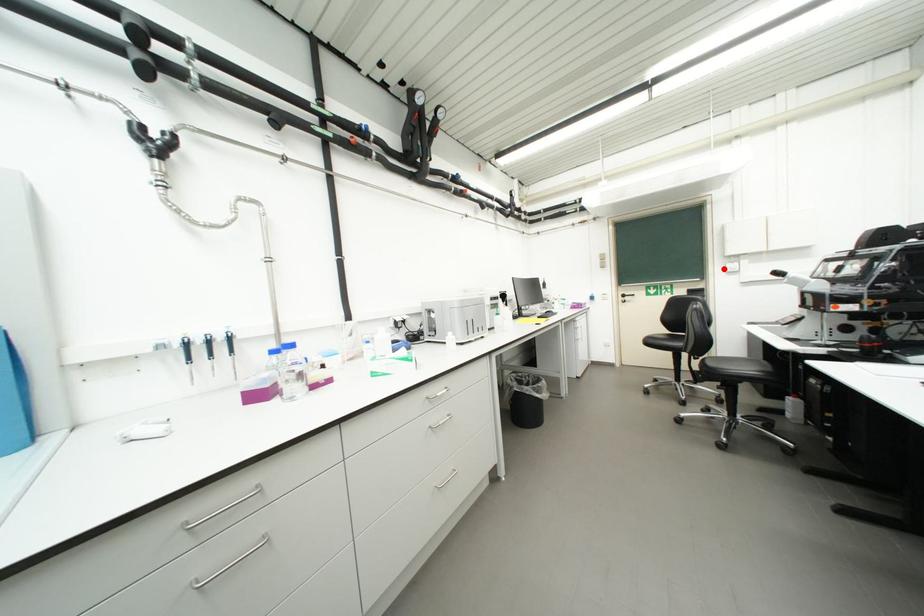
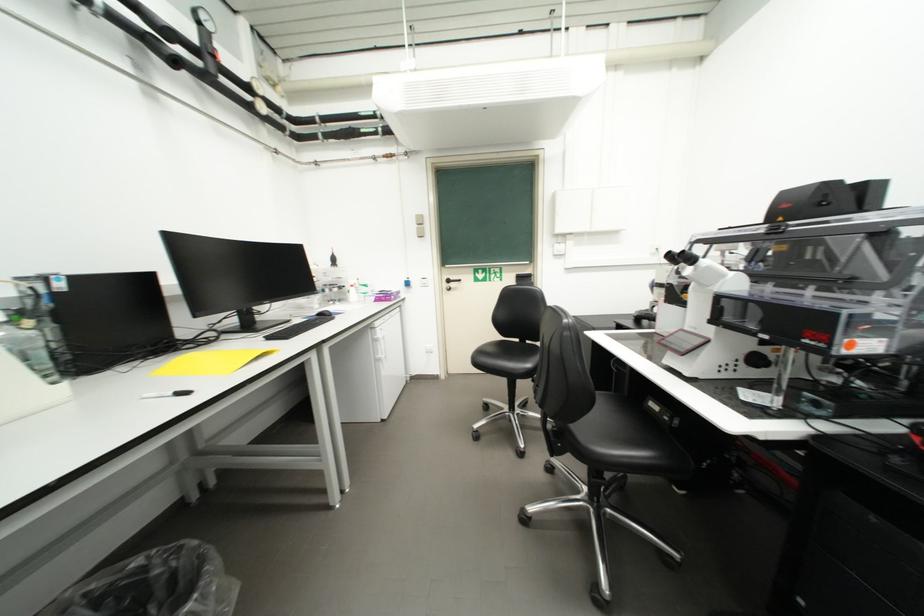
Question: I am providing you with two images of the same scene from different viewpoints. In image1, a red point is highlighted. Considering the same 3D point in image2, which of the following is correct?

Choices:
 (A) It is closer
 (B) It is farther

Answer: (A)